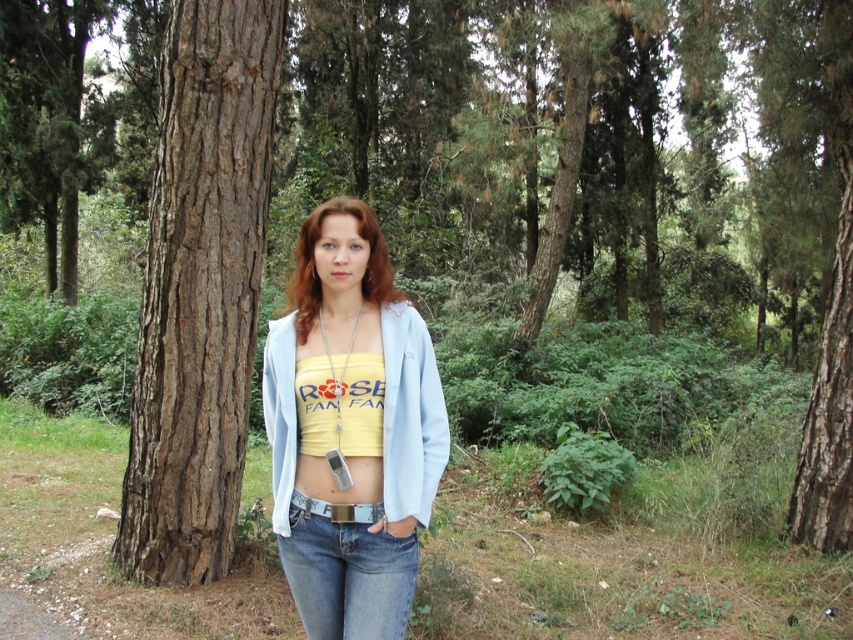
Is yellow fabric top at center smaller than denim at center?

No.

The width and height of the screenshot is (853, 640). In order to click on yellow fabric top at center in this screenshot , I will do `click(350, 429)`.

You are a GUI agent. You are given a task and a screenshot of the screen. Output one action in this format:
    pyautogui.click(x=<x>, y=<y>)
    Task: Click on the yellow fabric top at center
    The image size is (853, 640).
    Given the screenshot: What is the action you would take?
    pyautogui.click(x=350, y=429)

How distant is brown rough bark tree at left from denim at center?

brown rough bark tree at left is 2.21 meters from denim at center.

Does brown rough bark tree at left have a greater height compared to denim at center?

Yes.

Which is behind, point (219, 492) or point (306, 632)?

The point (219, 492) is behind.

Where is `brown rough bark tree at left`? The height and width of the screenshot is (640, 853). brown rough bark tree at left is located at coordinates (200, 291).

Which of these two, brown rough bark tree at left or yellow fabric top at center, stands shorter?

yellow fabric top at center is shorter.

Can you confirm if brown rough bark tree at left is positioned above yellow fabric top at center?

Yes.

What do you see at coordinates (200, 291) in the screenshot? Image resolution: width=853 pixels, height=640 pixels. I see `brown rough bark tree at left` at bounding box center [200, 291].

You are a GUI agent. You are given a task and a screenshot of the screen. Output one action in this format:
    pyautogui.click(x=<x>, y=<y>)
    Task: Click on the brown rough bark tree at left
    This screenshot has width=853, height=640.
    Given the screenshot: What is the action you would take?
    pyautogui.click(x=200, y=291)